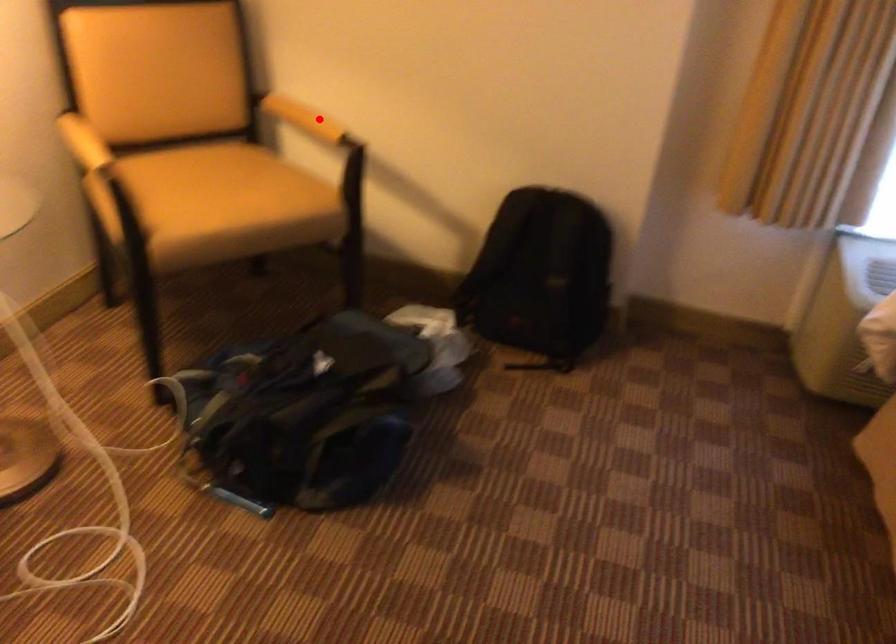
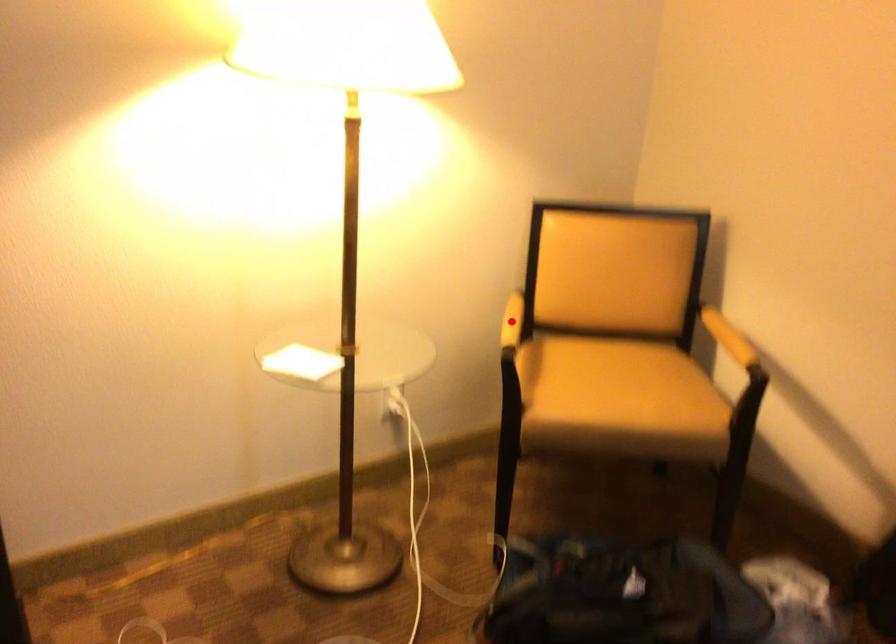
Looking at this image, I am providing you with two images of the same scene from different viewpoints. A red point is marked on the first image and another point is marked on the second image. Are the points marked in image1 and image2 representing the same 3D position?

No